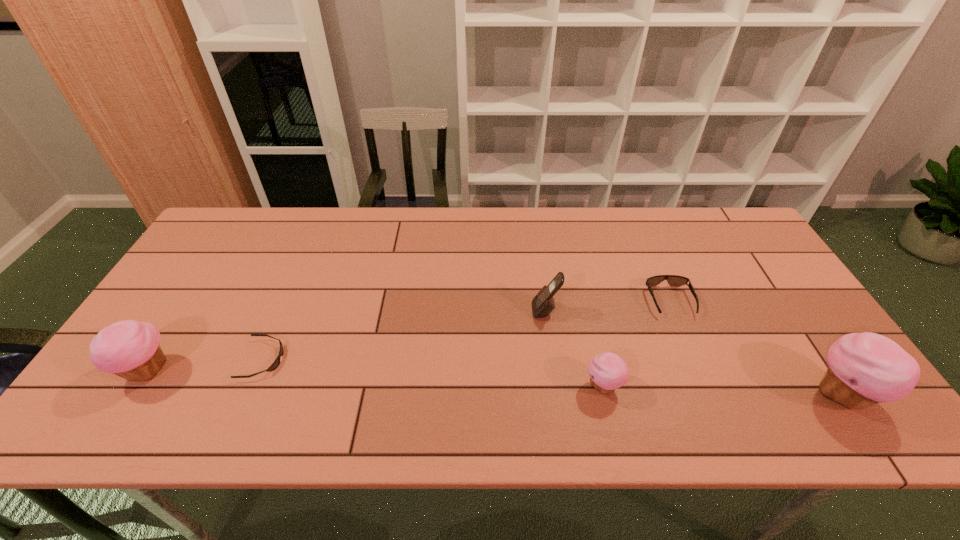
Find the location of a particular element. the leftmost object is located at coordinates (130, 349).

Locate an element on the screen. the second shortest cupcake is located at coordinates 130,349.

Find the location of a particular element. the fourth tallest object is located at coordinates (608, 371).

Locate an element on the screen. The height and width of the screenshot is (540, 960). the second cupcake from left to right is located at coordinates (608, 371).

Locate an element on the screen. The width and height of the screenshot is (960, 540). the rightmost object is located at coordinates (864, 369).

What are the coordinates of `cellular telephone` in the screenshot? It's located at (543, 303).

The image size is (960, 540). Identify the location of the fifth tallest object. pos(673,280).

The height and width of the screenshot is (540, 960). I want to click on the farther sunglasses, so click(x=673, y=280).

You are a GUI agent. You are given a task and a screenshot of the screen. Output one action in this format:
    pyautogui.click(x=<x>, y=<y>)
    Task: Click on the nearer sunglasses
    The width and height of the screenshot is (960, 540).
    Given the screenshot: What is the action you would take?
    pyautogui.click(x=275, y=364)

Find the location of `the second object from left to right`. the second object from left to right is located at coordinates (275, 364).